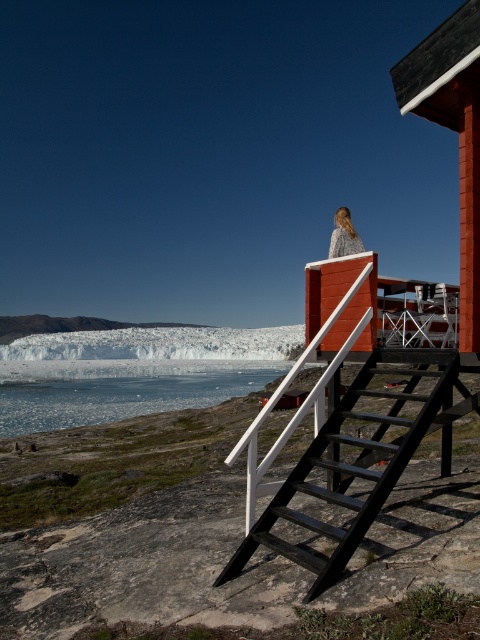
Is black wood stairs at upper center thinner than translucent ice at lower center?

Indeed, black wood stairs at upper center has a lesser width compared to translucent ice at lower center.

Does point (344, 468) lie behind point (199, 388)?

No, (344, 468) is in front of (199, 388).

Between point (272, 516) and point (96, 401), which one is positioned behind?

The point (96, 401) is more distant.

Where is `black wood stairs at upper center`? This screenshot has width=480, height=640. black wood stairs at upper center is located at coordinates (359, 461).

Is black wood stairs at upper center thinner than white ice at lower left?

Yes.

What are the coordinates of `black wood stairs at upper center` in the screenshot? It's located at (359, 461).

Is white ice at lower left to the right of blonde hair at upper center from the viewer's perspective?

No, white ice at lower left is not to the right of blonde hair at upper center.

Does white ice at lower left have a greater height compared to blonde hair at upper center?

Correct, white ice at lower left is much taller as blonde hair at upper center.

Which is behind, point (59, 349) or point (348, 227)?

Positioned behind is point (59, 349).

Identify the location of white ice at lower left. (158, 342).